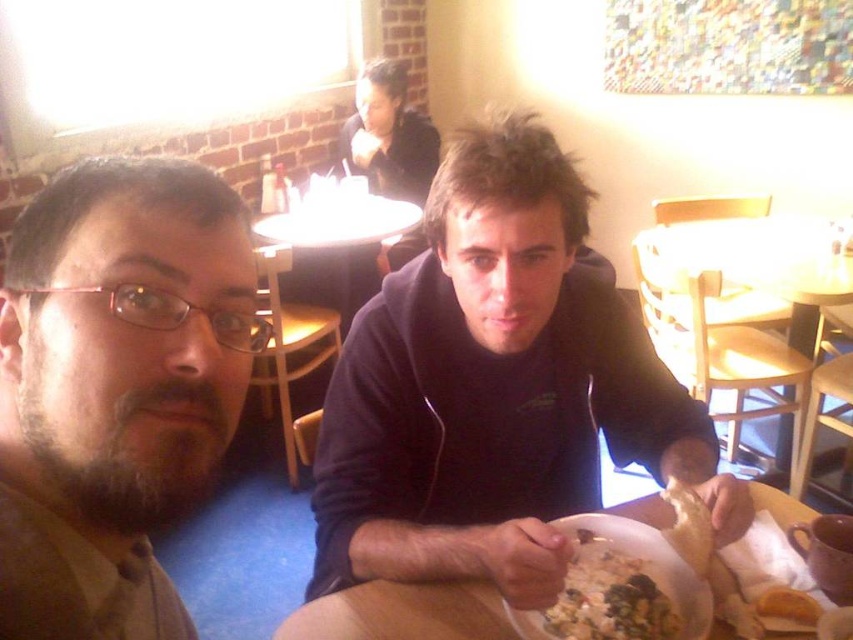
Question: Which point is closer to the camera?

Choices:
 (A) wooden at right
 (B) dark blue hoodie at center

Answer: (B)

Question: Does brown matte glasses at left lie behind white plastic plate at center?

Choices:
 (A) yes
 (B) no

Answer: (B)

Question: Can you confirm if wooden at right is thinner than golden crispy bread at lower right?

Choices:
 (A) yes
 (B) no

Answer: (B)

Question: Is brown matte glasses at left thinner than wooden at right?

Choices:
 (A) yes
 (B) no

Answer: (A)

Question: Which of the following is the farthest from the observer?

Choices:
 (A) (672, 600)
 (B) (685, 500)
 (C) (759, 612)
 (D) (518, 328)

Answer: (D)

Question: Which point is closer to the camera?

Choices:
 (A) brown matte glasses at left
 (B) wooden at right
 (C) golden crispy pastry at lower right
 (D) dark blue hoodie at center

Answer: (A)